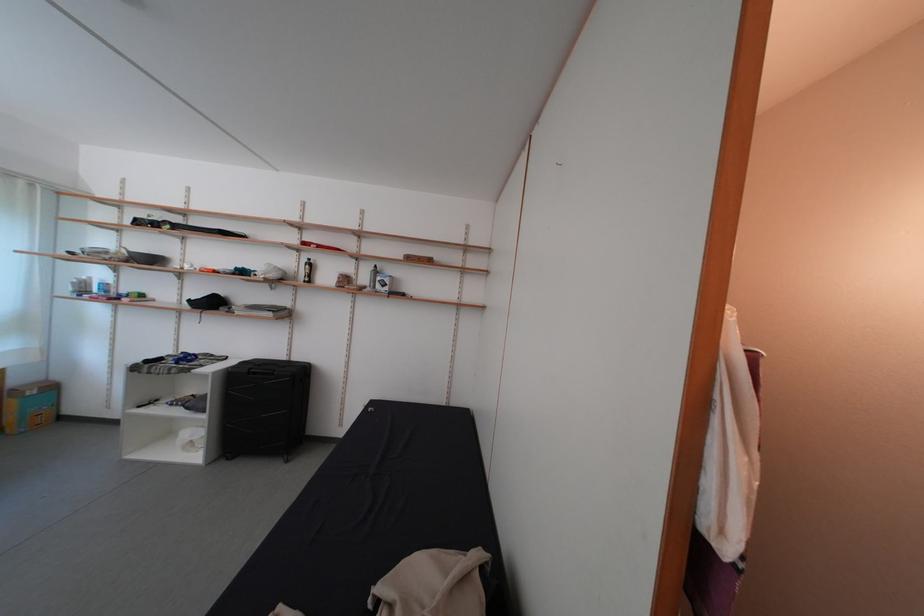
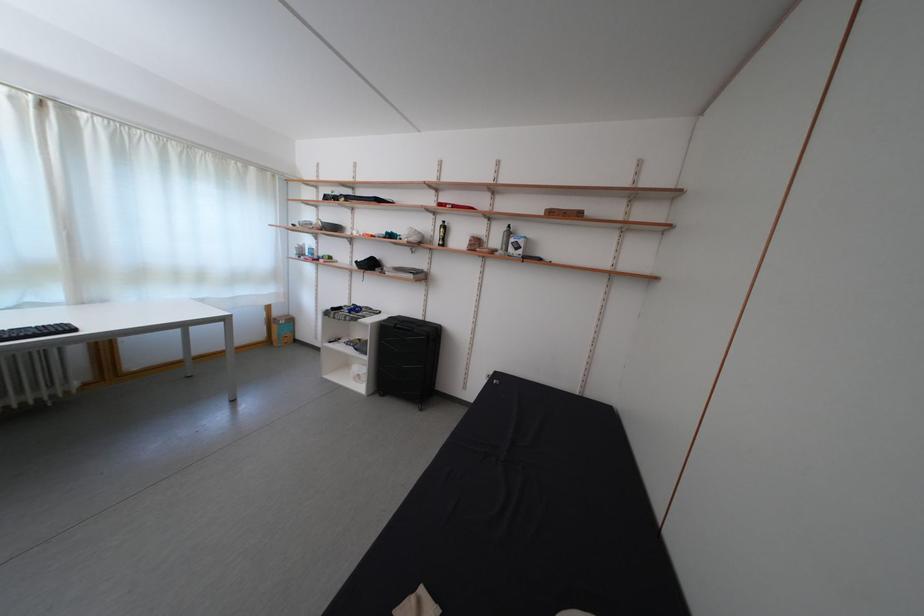
In the second image, find the point that corresponds to [196,448] in the first image.

(365, 381)